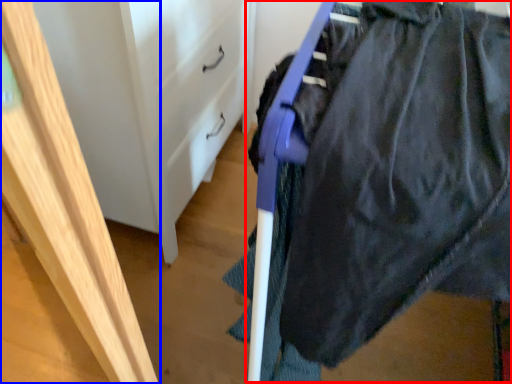
Question: Which point is further to the camera, wide (highlighted by a red box) or furniture (highlighted by a blue box)?

Choices:
 (A) wide
 (B) furniture

Answer: (A)